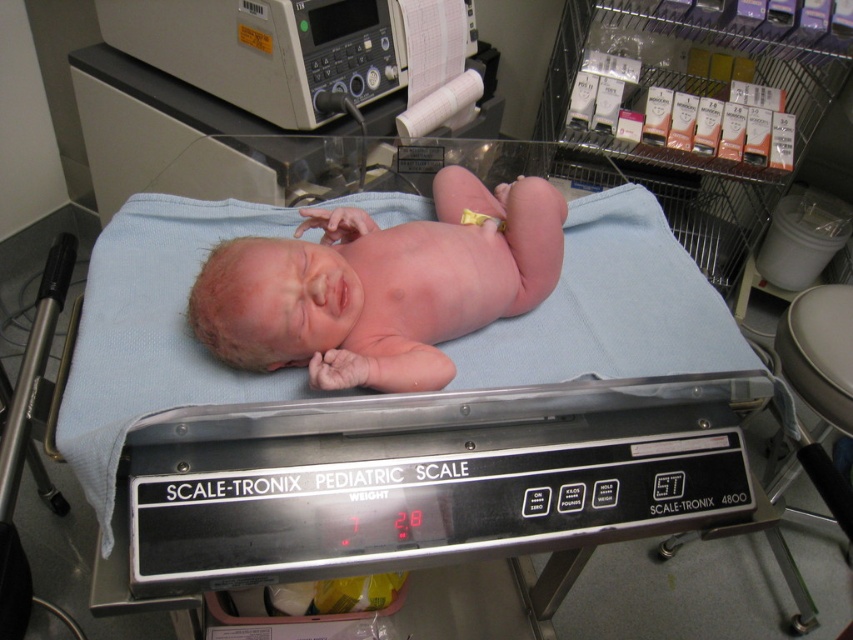
Is pink smooth skin at center wider than yellow fabric diaper at center?

Correct, the width of pink smooth skin at center exceeds that of yellow fabric diaper at center.

Who is positioned more to the left, pink smooth skin at center or yellow fabric diaper at center?

Positioned to the left is pink smooth skin at center.

The width and height of the screenshot is (853, 640). What are the coordinates of `pink smooth skin at center` in the screenshot? It's located at (381, 285).

Which is above, blue fabric hospital bed at center or pink smooth skin at center?

pink smooth skin at center is above.

Between point (555, 404) and point (389, 305), which one is positioned in front?

Positioned in front is point (555, 404).

The height and width of the screenshot is (640, 853). What are the coordinates of `blue fabric hospital bed at center` in the screenshot? It's located at (440, 346).

Who is shorter, gray plastic monitor at upper left or yellow fabric diaper at center?

Standing shorter between the two is yellow fabric diaper at center.

Is gray plastic monitor at upper left below yellow fabric diaper at center?

Incorrect, gray plastic monitor at upper left is not positioned below yellow fabric diaper at center.

Which is in front, point (257, 72) or point (459, 218)?

Point (459, 218) is in front.

The width and height of the screenshot is (853, 640). Find the location of `gray plastic monitor at upper left`. gray plastic monitor at upper left is located at coordinates (294, 49).